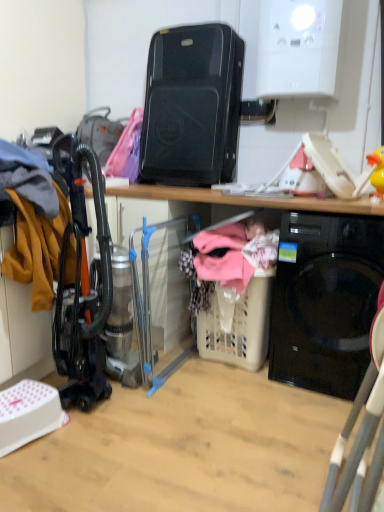
Question: Should I look upward or downward to see beige plastic laundry basket at lower center?

Choices:
 (A) up
 (B) down

Answer: (B)

Question: Is black plastic speaker at upper center, positioned as the second appliance in bottom-to-top order, taller than black glossy washing machine at lower right?

Choices:
 (A) no
 (B) yes

Answer: (A)

Question: Is there a large distance between black plastic speaker at upper center, positioned as the second appliance in bottom-to-top order, and black glossy washing machine at lower right?

Choices:
 (A) no
 (B) yes

Answer: (A)

Question: Is black plastic speaker at upper center, positioned as the second appliance in bottom-to-top order, oriented towards black glossy washing machine at lower right?

Choices:
 (A) no
 (B) yes

Answer: (A)

Question: Could black glossy washing machine at lower right be considered to be inside black plastic speaker at upper center, the first appliance positioned from the top?

Choices:
 (A) no
 (B) yes

Answer: (A)

Question: Is black plastic speaker at upper center, the first appliance positioned from the top, wider than black glossy washing machine at lower right?

Choices:
 (A) no
 (B) yes

Answer: (A)

Question: From the image's perspective, does black plastic speaker at upper center, positioned as the second appliance in bottom-to-top order, appear higher than black glossy washing machine at lower right?

Choices:
 (A) yes
 (B) no

Answer: (A)

Question: Is black glossy washing machine at lower right outside of clear plastic laundry basket at center, which appears as the second appliance when viewed from the top?

Choices:
 (A) yes
 (B) no

Answer: (A)

Question: Is black glossy washing machine at lower right aimed at clear plastic laundry basket at center, the 1th appliance positioned from the bottom?

Choices:
 (A) yes
 (B) no

Answer: (B)

Question: Does black glossy washing machine at lower right lie behind clear plastic laundry basket at center, the 1th appliance positioned from the bottom?

Choices:
 (A) yes
 (B) no

Answer: (B)

Question: Is black glossy washing machine at lower right not close to clear plastic laundry basket at center, the 1th appliance positioned from the bottom?

Choices:
 (A) yes
 (B) no

Answer: (B)

Question: Is clear plastic laundry basket at center, the 1th appliance positioned from the bottom, at the back of black glossy washing machine at lower right?

Choices:
 (A) yes
 (B) no

Answer: (B)

Question: Does black glossy washing machine at lower right appear on the right side of clear plastic laundry basket at center, the 1th appliance positioned from the bottom?

Choices:
 (A) yes
 (B) no

Answer: (A)

Question: Is clear plastic laundry basket at center, the 1th appliance positioned from the bottom, located outside beige plastic laundry basket at lower center?

Choices:
 (A) yes
 (B) no

Answer: (A)